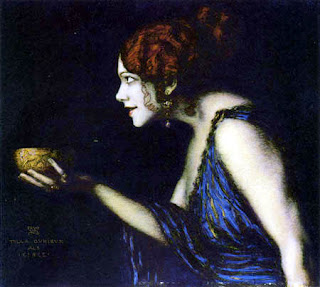
Locate an element on the screen. yellow bowl is located at coordinates (37, 159).